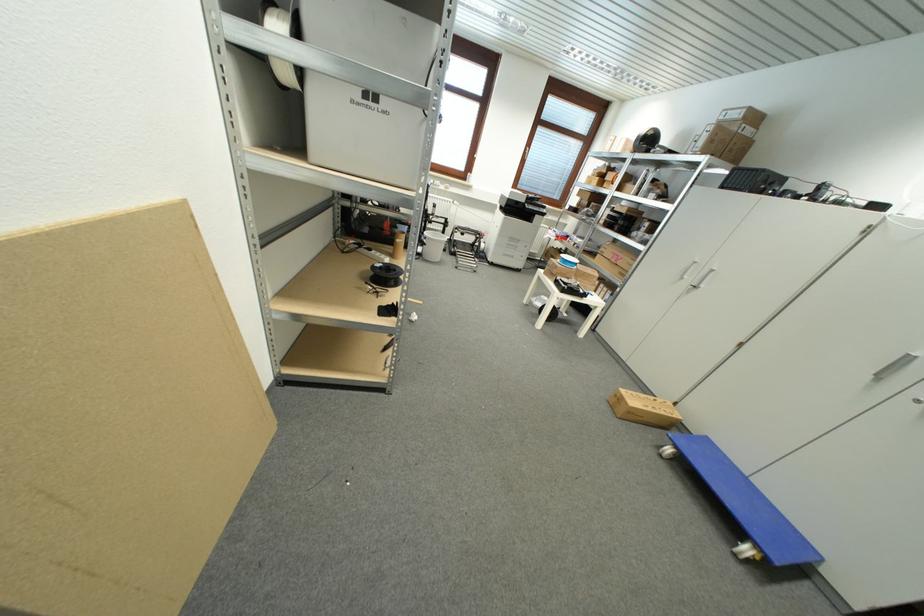
At what (x,y) coordinates should I click in order to perform the action: click on white stool sitting surface. Please return your answer as a coordinate pair (x, y). Looking at the image, I should click on (558, 293).